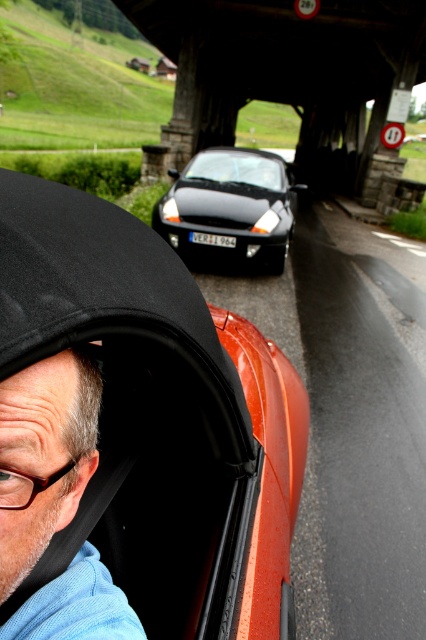
You are a pedestrian standing on the sidewalk under the bridge. You see the shiny orange car at center and the glossy black car at center. Which car is closer to the left side of the bridge?

The shiny orange car at center is closer to the left side of the bridge because it is positioned to the left of the glossy black car at center.

You are standing at the point with coordinates point (158, 417) in the scene. What object is exactly at that point?

The point (158, 417) corresponds to the shiny orange car at center.

You are a pedestrian standing on the sidewalk next to the bridge. You see the shiny orange car at center and the glossy black car at center. Which car is closer to the ground?

The shiny orange car at center is below the glossy black car at center, so it is closer to the ground.